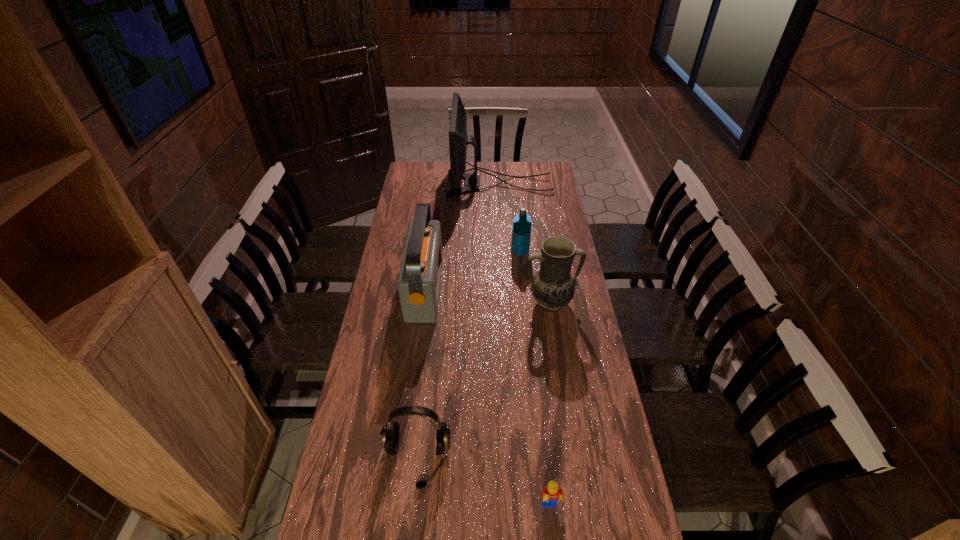
Where is `vacant space situated 0.070m on the screen side of the computer monitor`? vacant space situated 0.070m on the screen side of the computer monitor is located at coordinates (434, 184).

I want to click on free space located on the front-facing side of the radio receiver, so click(505, 289).

This screenshot has height=540, width=960. In order to click on vacant space situated 0.150m on the front of the pottery in this screenshot , I will do `click(559, 352)`.

Image resolution: width=960 pixels, height=540 pixels. I want to click on blank space located on the front of the thermos bottle, so click(x=523, y=282).

Where is `blank space located with the microphone on the side of the headset`? This screenshot has height=540, width=960. blank space located with the microphone on the side of the headset is located at coordinates (411, 519).

Locate an element on the screen. object situated at the far edge is located at coordinates (458, 140).

The image size is (960, 540). Identify the location of radio receiver that is positioned at the left edge. (419, 278).

Locate an element on the screen. headset at the left edge is located at coordinates (390, 432).

Where is `computer monitor at the right edge`? computer monitor at the right edge is located at coordinates (458, 140).

Where is `pottery at the right edge`? This screenshot has height=540, width=960. pottery at the right edge is located at coordinates (553, 287).